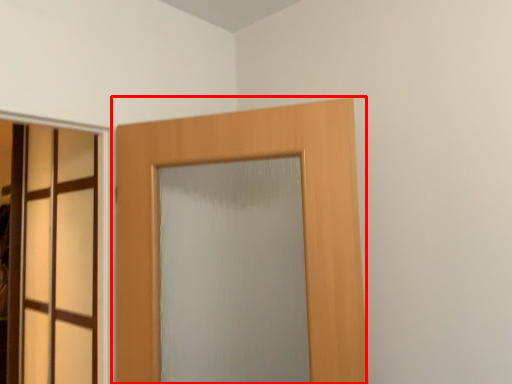
Question: In this image, where is door (annotated by the red box) located relative to door?

Choices:
 (A) left
 (B) right

Answer: (B)